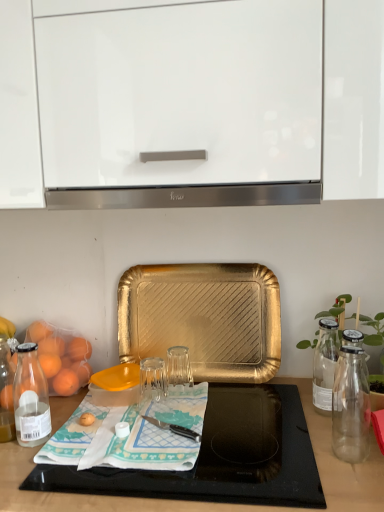
Question: Is point (137, 200) positioned closer to the camera than point (102, 458)?

Choices:
 (A) closer
 (B) farther

Answer: (B)

Question: Considering the positions of satin silver exhaust hood at center and teal fabric placemat at center in the image, is satin silver exhaust hood at center taller or shorter than teal fabric placemat at center?

Choices:
 (A) short
 (B) tall

Answer: (B)

Question: Which object is positioned closest to the translucent glass bottle at left?

Choices:
 (A) transparent plastic cutting board at lower center
 (B) green glass bottle at right
 (C) satin silver exhaust hood at center
 (D) gold textured tray at center
 (E) glossy white cabinet at upper center

Answer: (A)

Question: Considering the real-world distances, which object is closest to the satin silver exhaust hood at center?

Choices:
 (A) transparent glass at center
 (B) glossy white cabinet at upper center
 (C) transparent glass at center
 (D) gold textured tray at center
 (E) transparent plastic cutting board at lower center

Answer: (B)